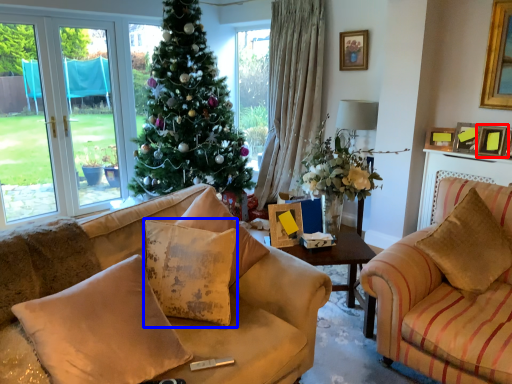
Question: Which object is closer to the camera taking this photo, picture frame (highlighted by a red box) or pillow (highlighted by a blue box)?

Choices:
 (A) picture frame
 (B) pillow

Answer: (B)